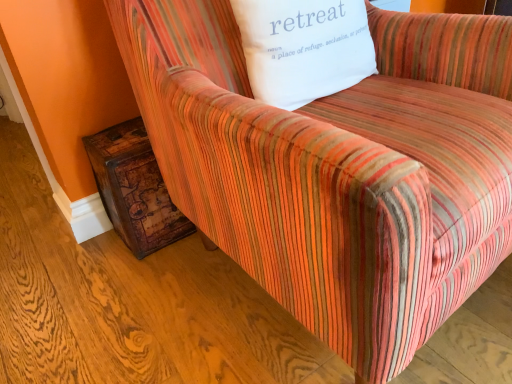
Locate an element on the screen. The height and width of the screenshot is (384, 512). vacant space to the right of rustic wood side table at lower left is located at coordinates (192, 247).